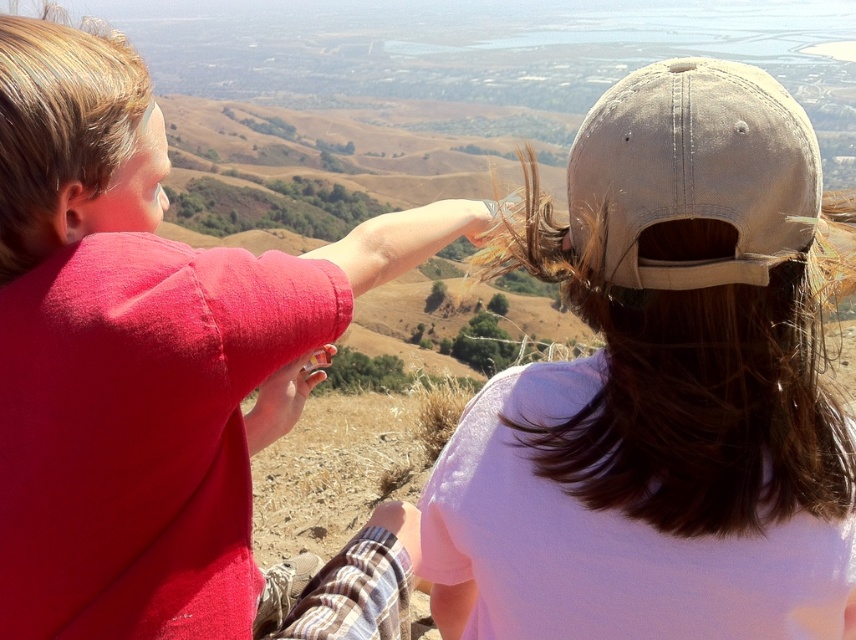
You are a photographer trying to capture a clear shot of both the brown matte hair at upper right and the light brown fabric baseball cap at upper right. However, you notice that one of them is blocking the other. Which object is being obscured by the other?

The light brown fabric baseball cap at upper right is behind brown matte hair at upper right, so the light brown fabric baseball cap at upper right is being obscured by the brown matte hair at upper right.

You are a photographer trying to capture a photo of both the brown matte hair at upper right and the blonde smooth hair at upper left. Based on their heights, which person should you position closer to the camera to ensure both are fully visible in the frame?

Since the brown matte hair at upper right is shorter than the blonde smooth hair at upper left, you should position the person with the brown matte hair at upper right closer to the camera to ensure both are fully visible in the frame.